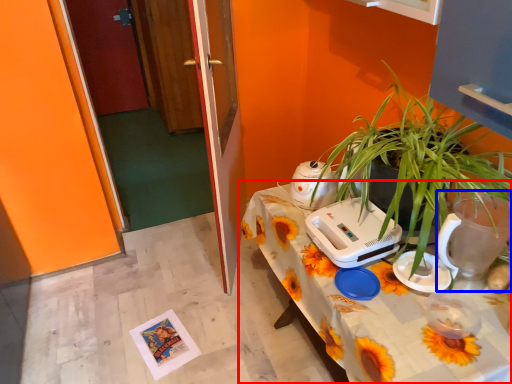
Question: Among these objects, which one is nearest to the camera, table (highlighted by a red box) or appliance (highlighted by a blue box)?

Choices:
 (A) table
 (B) appliance

Answer: (A)